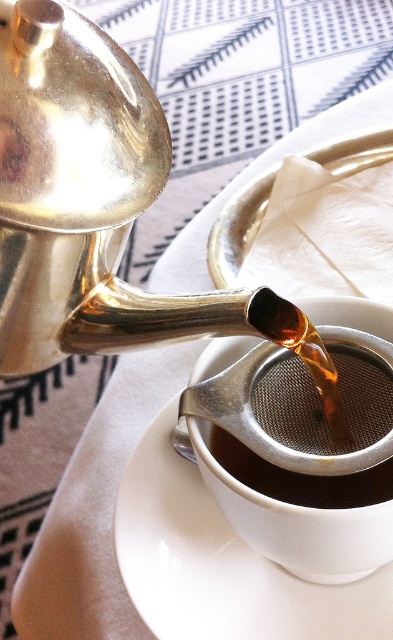
Does white ceramic saucer at center have a greater width compared to shiny metallic coffee at center?

Correct, the width of white ceramic saucer at center exceeds that of shiny metallic coffee at center.

Find the location of a particular element. The width and height of the screenshot is (393, 640). white ceramic saucer at center is located at coordinates (220, 563).

Where is `white ceramic saucer at center`? white ceramic saucer at center is located at coordinates (220, 563).